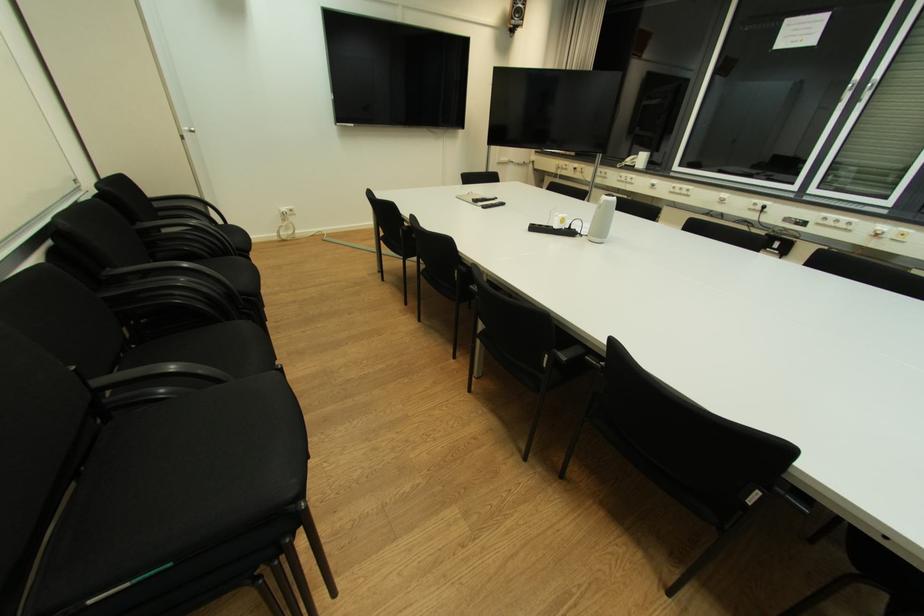
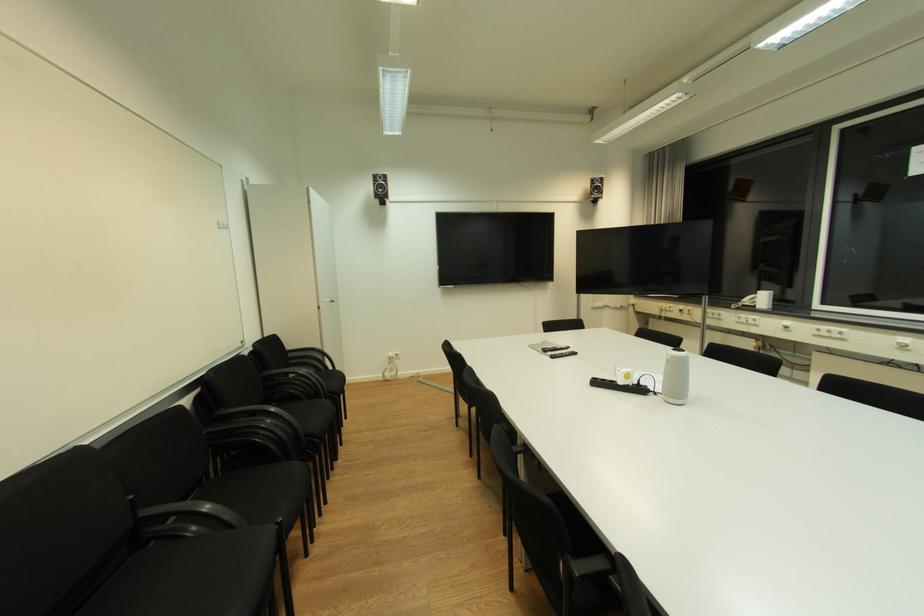
In the second image, find the point that corresponds to (611,203) in the first image.

(678, 358)